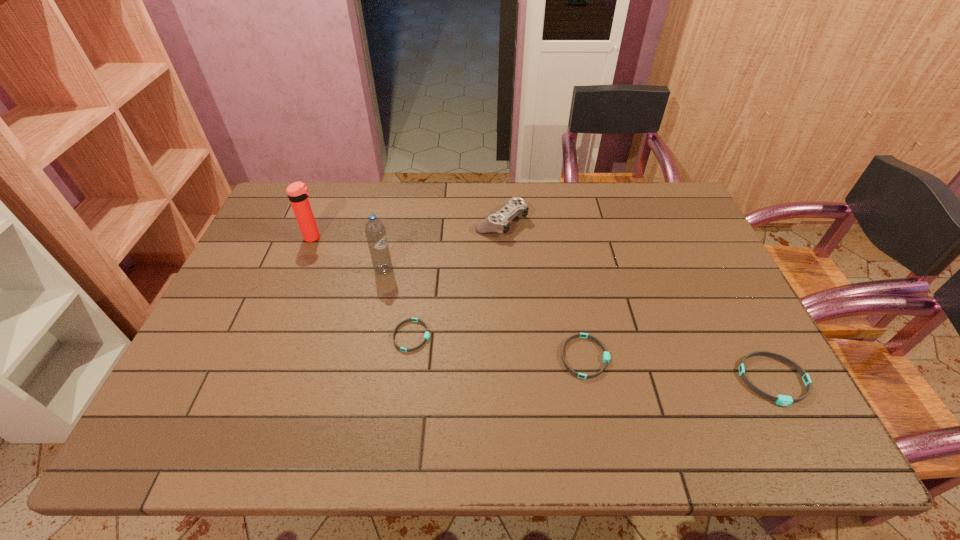
Identify the location of the shortest object. (427, 335).

This screenshot has width=960, height=540. Identify the location of the leftmost wristband. (427, 335).

Where is `the second wristband from left to right`? This screenshot has width=960, height=540. the second wristband from left to right is located at coordinates (606, 355).

Identify the location of the second tallest wristband. The image size is (960, 540). (606, 355).

Image resolution: width=960 pixels, height=540 pixels. I want to click on the tallest wristband, so click(783, 400).

Identify the location of the rightmost wristband. This screenshot has width=960, height=540. (783, 400).

Identify the location of thermos bottle. (297, 192).

Identify the location of the third tallest object. coord(498,222).

Where is `the fourth object from left to right`? This screenshot has width=960, height=540. the fourth object from left to right is located at coordinates click(x=498, y=222).

You are a GUI agent. You are given a task and a screenshot of the screen. Output one action in this format:
    pyautogui.click(x=<x>, y=<y>)
    Task: Click on the water bottle
    The image size is (960, 540).
    Given the screenshot: What is the action you would take?
    pyautogui.click(x=375, y=231)